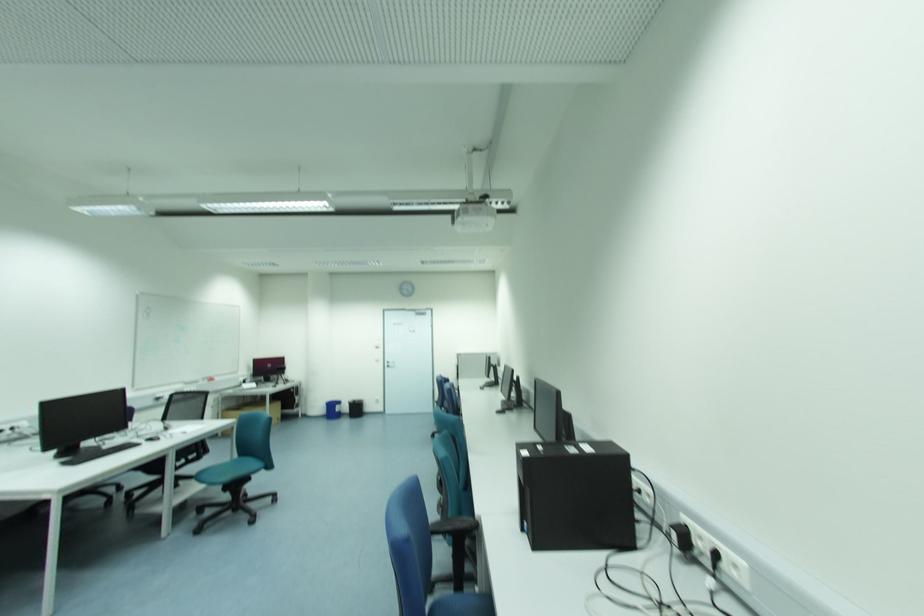
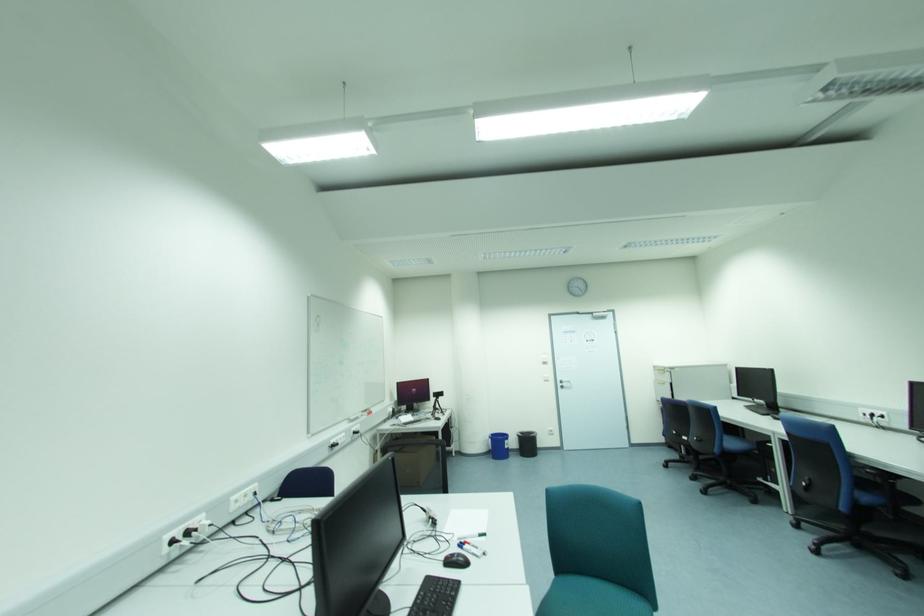
The images are taken continuously from a first-person perspective. In which direction are you moving?

The cameraman walked toward left, forward.